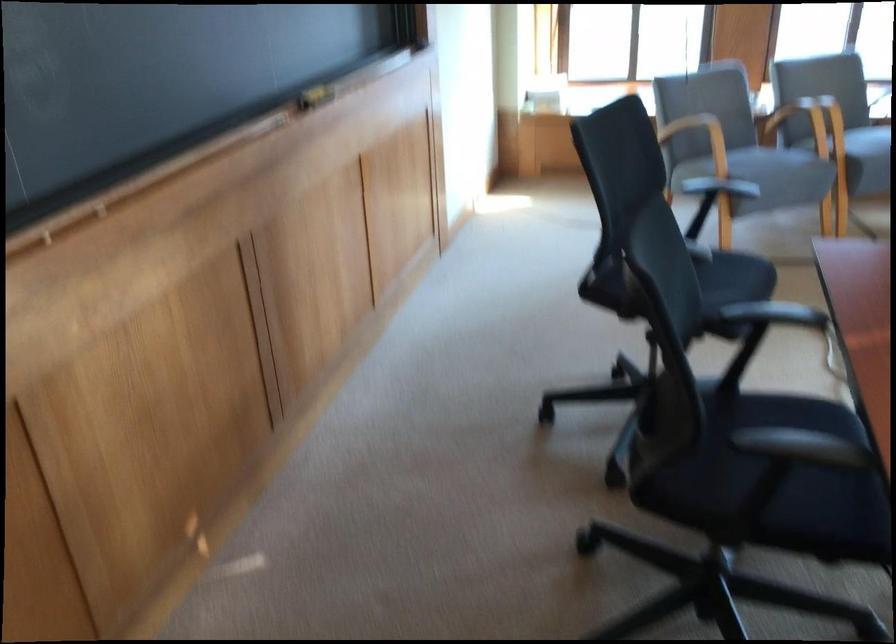
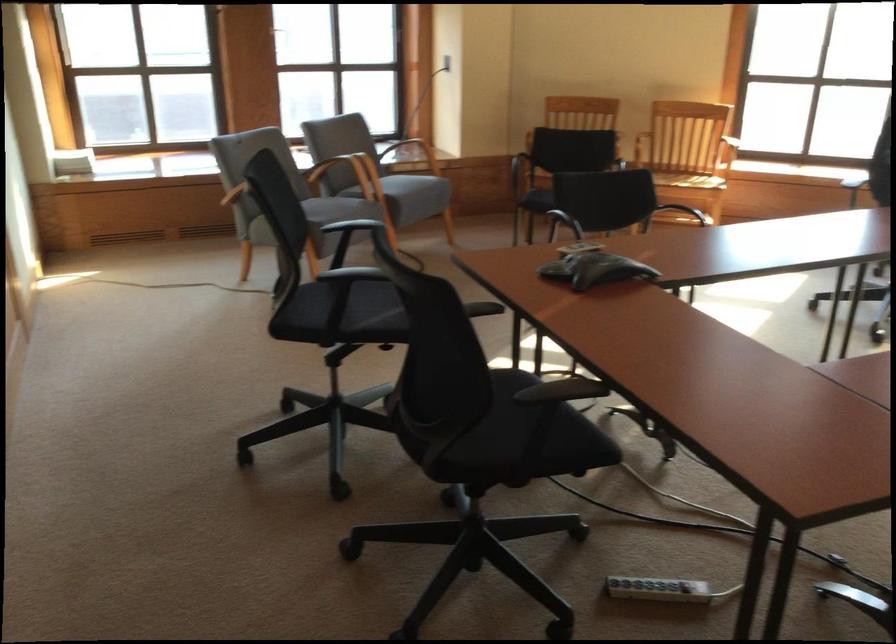
Question: I am providing you with two images of the same scene from different viewpoints. After the viewpoint changes to image2, which objects are now occluded?

Choices:
 (A) yellow and black backpack
 (B) white power strip
 (C) black chair armrest
 (D) grey chair sitting surface

Answer: (C)